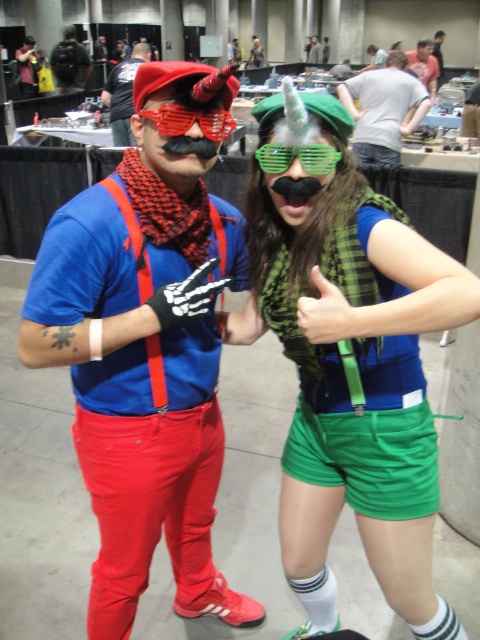
Question: Does matte red pants at left lie behind matte black backpack at upper left?

Choices:
 (A) no
 (B) yes

Answer: (A)

Question: Observing the image, what is the correct spatial positioning of matte red pants at left in reference to matte black mustache at center?

Choices:
 (A) right
 (B) left

Answer: (B)

Question: Which is farther from the green matte vest at center?

Choices:
 (A) matte black backpack at upper left
 (B) green plastic goggles at center

Answer: (A)

Question: Can you confirm if green fabric shirt at center is positioned to the right of translucent red plastic goggles at center?

Choices:
 (A) yes
 (B) no

Answer: (A)

Question: Which is farther from the matte black backpack at upper left?

Choices:
 (A) green plastic goggles at center
 (B) matte red pants at left
 (C) green fabric shirt at center

Answer: (A)

Question: Based on their relative distances, which object is farther from the matte red pants at left?

Choices:
 (A) matte black backpack at upper left
 (B) green plastic goggles at center
 (C) matte red suspenders at center
 (D) translucent red plastic goggles at center

Answer: (A)